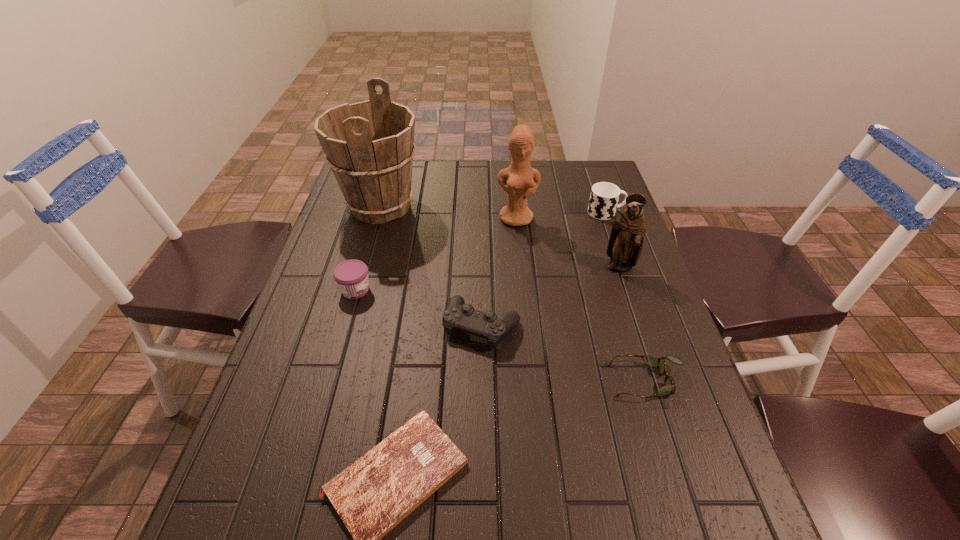
Where is `free location located on the front of the tallest object`? Image resolution: width=960 pixels, height=540 pixels. free location located on the front of the tallest object is located at coordinates pos(354,299).

This screenshot has width=960, height=540. What are the coordinates of `free point located 0.150m on the front-facing side of the taller figurine` in the screenshot? It's located at (521, 262).

Find the location of a particular element. The width and height of the screenshot is (960, 540). free space located 0.320m on the front-facing side of the shorter figurine is located at coordinates [x=657, y=383].

At what (x,y) coordinates should I click in order to perform the action: click on vacant space located on the front label of the jam. Please return your answer as a coordinate pair (x, y). Image resolution: width=960 pixels, height=540 pixels. Looking at the image, I should click on (504, 289).

This screenshot has height=540, width=960. What are the coordinates of `vacant space located on the front of the control` in the screenshot? It's located at (482, 468).

This screenshot has height=540, width=960. Find the location of `vacant space located on the front-facing side of the second shortest object`. vacant space located on the front-facing side of the second shortest object is located at coordinates (570, 381).

The width and height of the screenshot is (960, 540). I want to click on vacant space located on the front-facing side of the second shortest object, so click(556, 381).

Find the location of a particular element. This screenshot has height=540, width=960. vacant space located 0.220m on the front-facing side of the second shortest object is located at coordinates (510, 381).

You are a GUI agent. You are given a task and a screenshot of the screen. Output one action in this format:
    pyautogui.click(x=<x>, y=<y>)
    Task: Click on the object located in the far edge section of the desktop
    The width and height of the screenshot is (960, 540).
    Given the screenshot: What is the action you would take?
    pyautogui.click(x=369, y=145)

Find the location of `bucket positioned at the left edge`. bucket positioned at the left edge is located at coordinates 369,145.